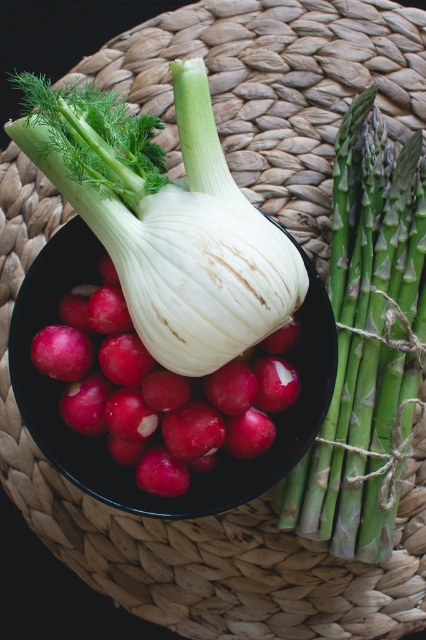
Question: Does green textured asparagus at right have a greater width compared to black matte bowl at center?

Choices:
 (A) no
 (B) yes

Answer: (A)

Question: Does white matte fennel bulb at center appear on the left side of green textured asparagus at right?

Choices:
 (A) no
 (B) yes

Answer: (B)

Question: Among these objects, which one is nearest to the camera?

Choices:
 (A) white matte fennel bulb at center
 (B) black matte bowl at center
 (C) green textured asparagus at right

Answer: (A)

Question: Which object is the closest to the green textured asparagus at right?

Choices:
 (A) black matte bowl at center
 (B) white matte fennel bulb at center

Answer: (A)

Question: Does green textured asparagus at right appear under black matte bowl at center?

Choices:
 (A) yes
 (B) no

Answer: (B)

Question: Which point appears farthest from the camera in this image?

Choices:
 (A) (344, 508)
 (B) (287, 460)
 (C) (115, 164)

Answer: (A)